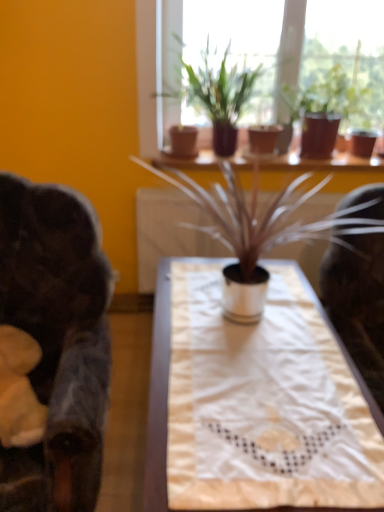
Locate an element on the screen. The image size is (384, 512). free space above white fabric table at center (from a real-world perspective) is located at coordinates (238, 351).